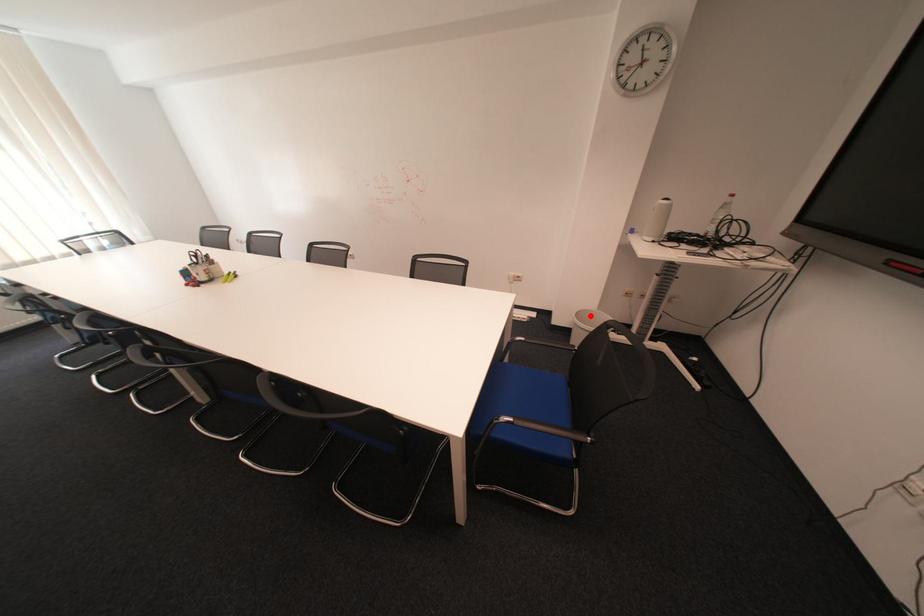
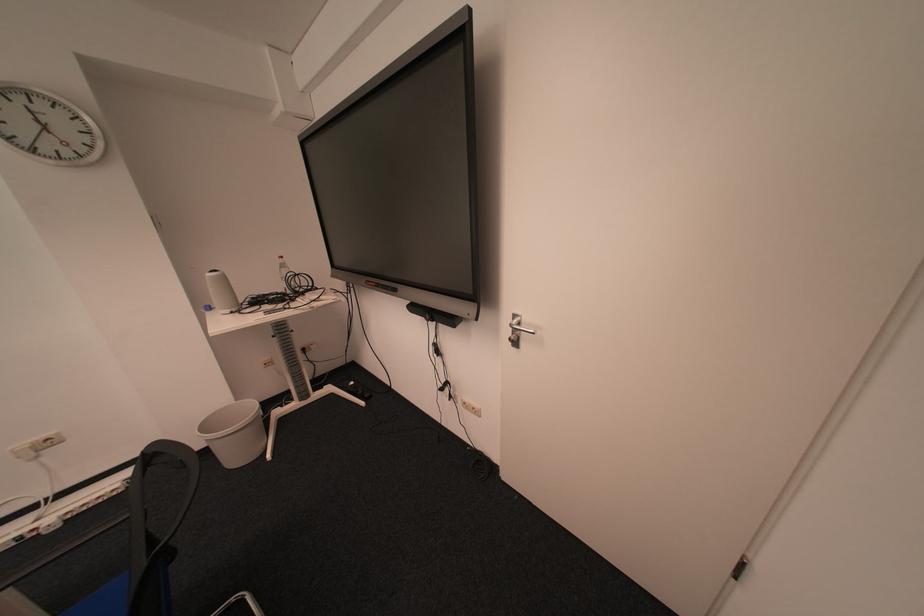
The point at the highlighted location is marked in the first image. Where is the corresponding point in the second image?

(216, 426)